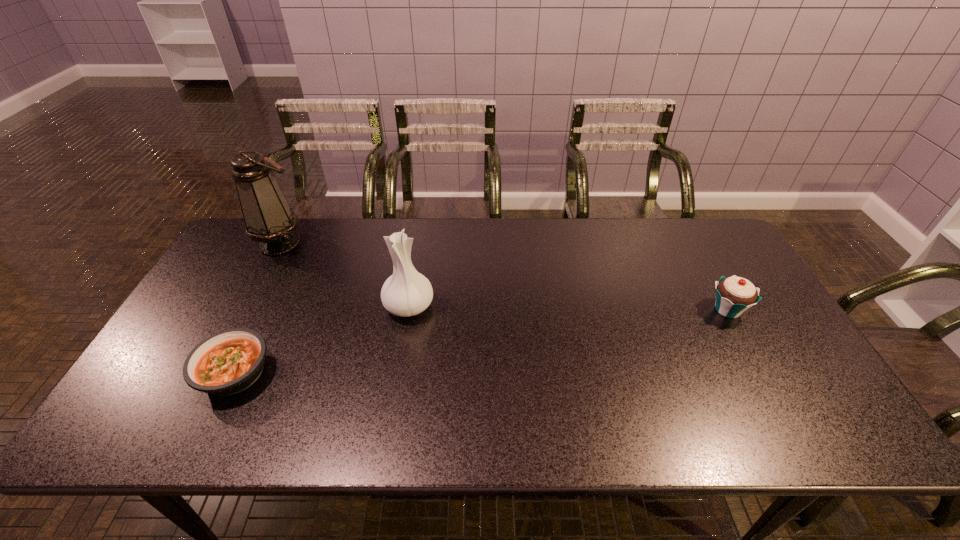
In the image, there is a desktop. Where is `free space at the right edge`? The height and width of the screenshot is (540, 960). free space at the right edge is located at coordinates (765, 394).

This screenshot has height=540, width=960. In the image, there is a desktop. Find the location of `free space at the near left corner`. free space at the near left corner is located at coordinates (126, 438).

Where is `vacant space at the far right corner of the desktop`? vacant space at the far right corner of the desktop is located at coordinates (684, 231).

The width and height of the screenshot is (960, 540). I want to click on free space between the second object from right to left and the oil lamp, so click(345, 274).

You are a GUI agent. You are given a task and a screenshot of the screen. Output one action in this format:
    pyautogui.click(x=<x>, y=<y>)
    Task: Click on the vacant space that's between the vase and the rightmost object
    This screenshot has height=540, width=960.
    Given the screenshot: What is the action you would take?
    pyautogui.click(x=568, y=308)

You are a GUI agent. You are given a task and a screenshot of the screen. Output one action in this format:
    pyautogui.click(x=<x>, y=<y>)
    Task: Click on the free space between the shortest object and the second tallest object
    Image resolution: width=960 pixels, height=540 pixels.
    Given the screenshot: What is the action you would take?
    pyautogui.click(x=322, y=339)

You are a GUI agent. You are given a task and a screenshot of the screen. Output one action in this format:
    pyautogui.click(x=<x>, y=<y>)
    Task: Click on the free area in between the second object from right to left and the tallest object
    
    Given the screenshot: What is the action you would take?
    pyautogui.click(x=345, y=274)

Locate an element on the screen. The image size is (960, 540). blank region between the shortest object and the tallest object is located at coordinates (257, 307).

This screenshot has height=540, width=960. I want to click on free space between the tallest object and the stew, so click(x=257, y=307).

Find the location of a particular element. This screenshot has width=960, height=540. free spot between the cupcake and the vase is located at coordinates (568, 308).